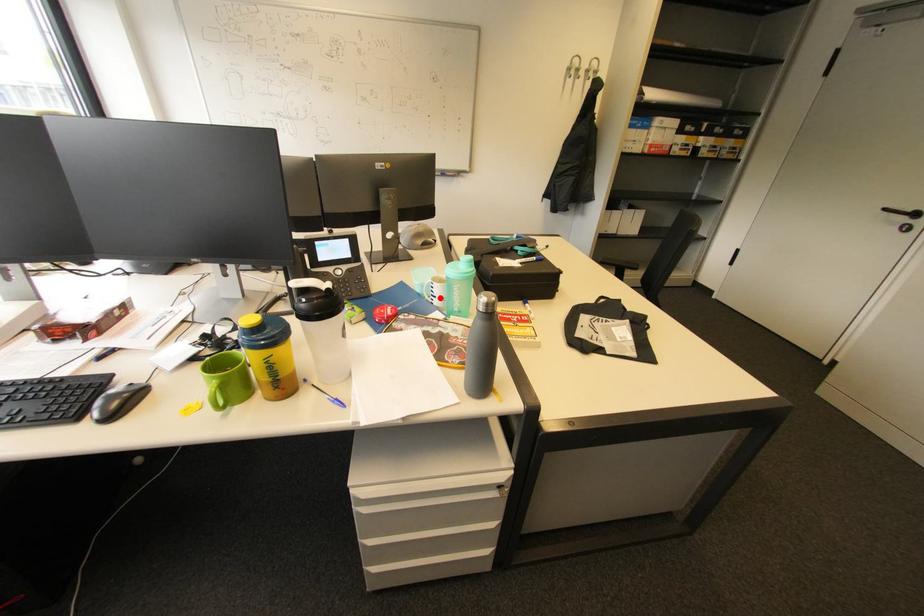
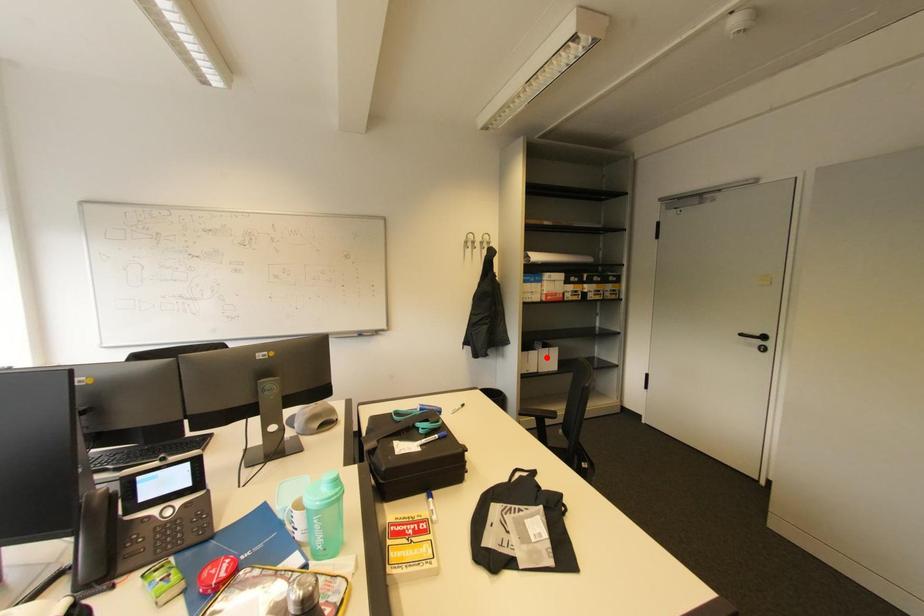
I am providing you with two images of the same scene from different viewpoints. A red point is marked on the first image and another point is marked on the second image. Is the red point in image1 aligned with the point shown in image2?

No